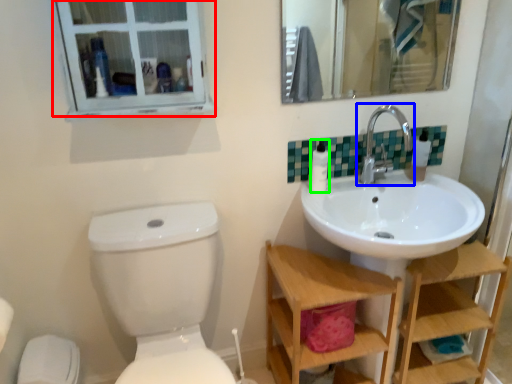
Question: Which object is the farthest from window (highlighted by a red box)? Choose among these: tap (highlighted by a blue box) or toilet paper (highlighted by a green box).

Choices:
 (A) tap
 (B) toilet paper

Answer: (A)